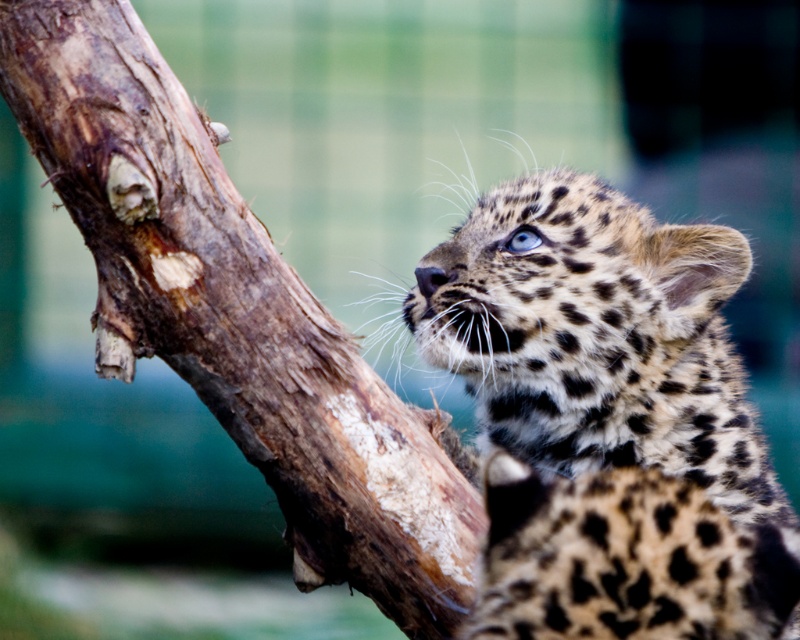
Based on the scene, where is the spotted fur leopard at upper center in relation to the brown rough tree trunk at upper left?

The spotted fur leopard at upper center is below the brown rough tree trunk at upper left.

You are a wildlife photographer aiming to capture a close shot of the spotted fur leopard at upper center and the brown rough tree trunk at upper left in the same frame. Given that your camera lens has a focal length of 200mm, can you estimate whether the two subjects are within the camera lens range to be captured together?

The distance between the spotted fur leopard at upper center and the brown rough tree trunk at upper left is 20.14 inches. Since the camera lens with a focal length of 200mm can capture subjects within a range that includes this distance, the photographer can likely capture both subjects in the same frame.

You are a wildlife photographer aiming to capture the spotted fur leopard at upper center and the brown rough tree trunk at upper left in the same frame. Based on their positions, which one will appear closer to the camera lens?

The spotted fur leopard at upper center will appear closer to the camera lens because it is further to the viewer than the brown rough tree trunk at upper left.